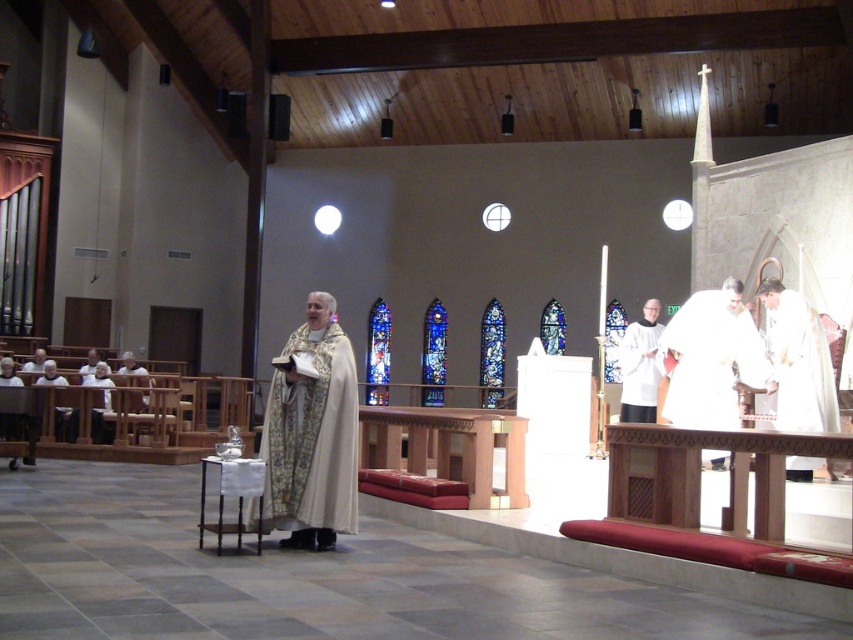
Question: Can you confirm if white clothed figure at right is thinner than white matte robe at center?

Choices:
 (A) yes
 (B) no

Answer: (B)

Question: Among these objects, which one is farthest from the camera?

Choices:
 (A) white cloth at right
 (B) white textured robe at center
 (C) wooden altar at center

Answer: (C)

Question: Is white cloth at right above white matte robe at center?

Choices:
 (A) yes
 (B) no

Answer: (A)

Question: Is wooden altar at center smaller than white matte robe at center?

Choices:
 (A) yes
 (B) no

Answer: (B)

Question: Which point is closer to the camera taking this photo?

Choices:
 (A) (61, 420)
 (B) (805, 332)

Answer: (B)

Question: Among these points, which one is nearest to the camera?

Choices:
 (A) (679, 394)
 (B) (62, 408)

Answer: (A)